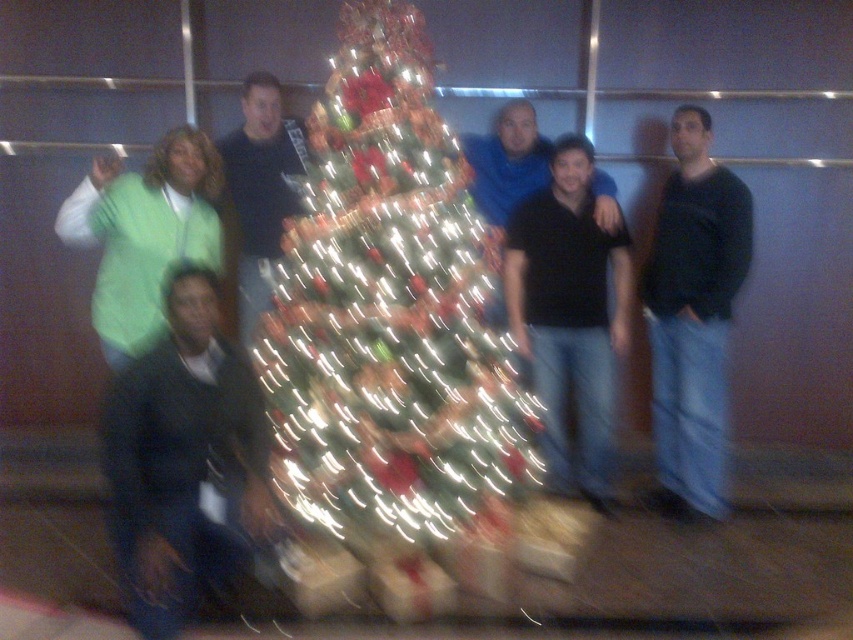
You are a photographer trying to focus on the matte black shirt at center. There are two people in front of it, one wearing green fleece at left and another. Do you need to adjust your focus to account for their distance?

The green fleece at left is closer to the viewer than the matte black shirt at center, so the photographer needs to adjust focus to ensure the matte black shirt at center is in focus instead of the green fleece at left.

Based on the photo, you are standing in front of the green matte christmas tree at center and want to hand a gift to the person wearing the dark blue jacket at lower left. Which direction should you move to reach them?

The dark blue jacket at lower left is behind the green matte christmas tree at center, so you should move around or behind the tree to reach them.